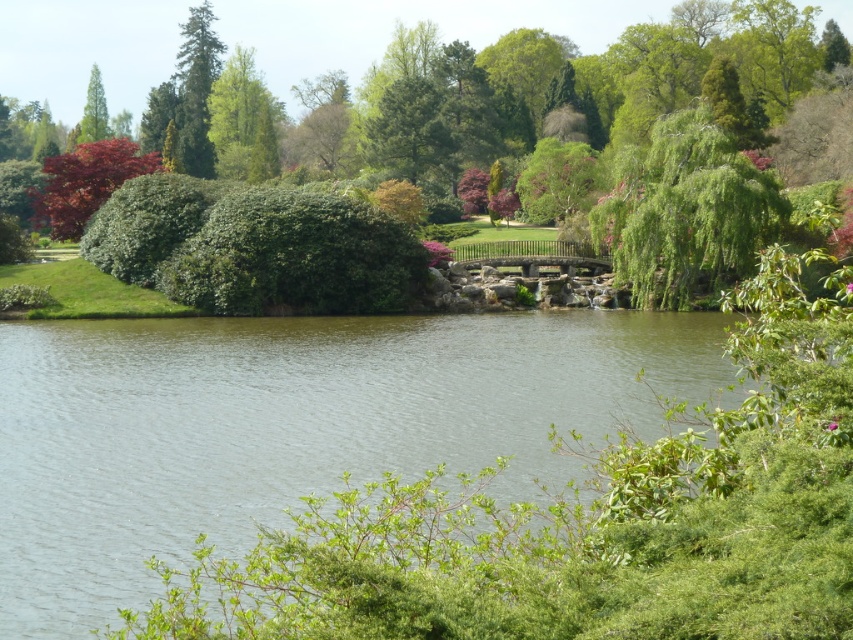
You are planning to install a bird feeder between the green leafy tree at upper left and the green textured tree at upper left. The feeder requires a minimum of 20 feet of space between the two trees to ensure it doesn

The green leafy tree at upper left is 22.41 feet from the green textured tree at upper left, which meets the minimum requirement of 20 feet. Therefore, the bird feeder can be installed between them.

You are standing in the garden and want to take a photo of the green leafy bush at upper center. If your camera has a maximum focus range of 200 feet, will it be able to capture the bush clearly?

The green leafy bush at upper center is 228.69 feet away from the viewer, which exceeds the camera maximum focus range of 200 feet. Therefore, the camera cannot capture the bush clearly.